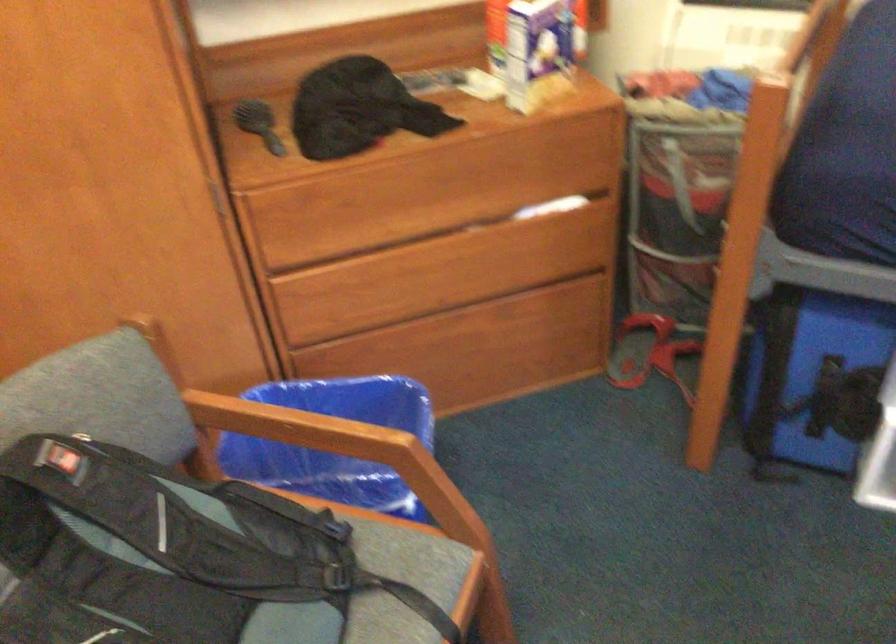
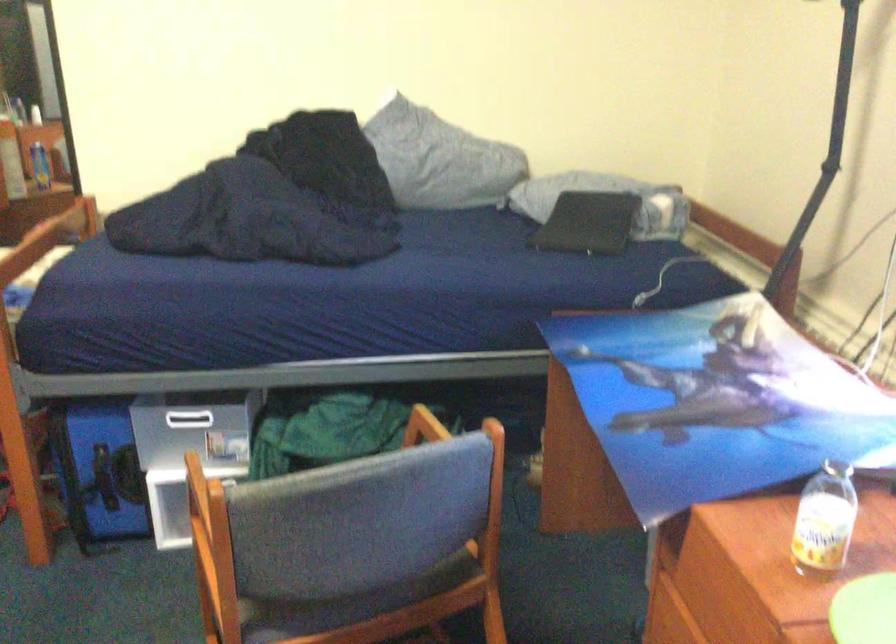
Question: The camera is either moving clockwise (left) or counter-clockwise (right) around the object. The first image is from the beginning of the video and the second image is from the end. Is the camera moving left or right when shooting the video?

Choices:
 (A) Left
 (B) Right

Answer: (A)